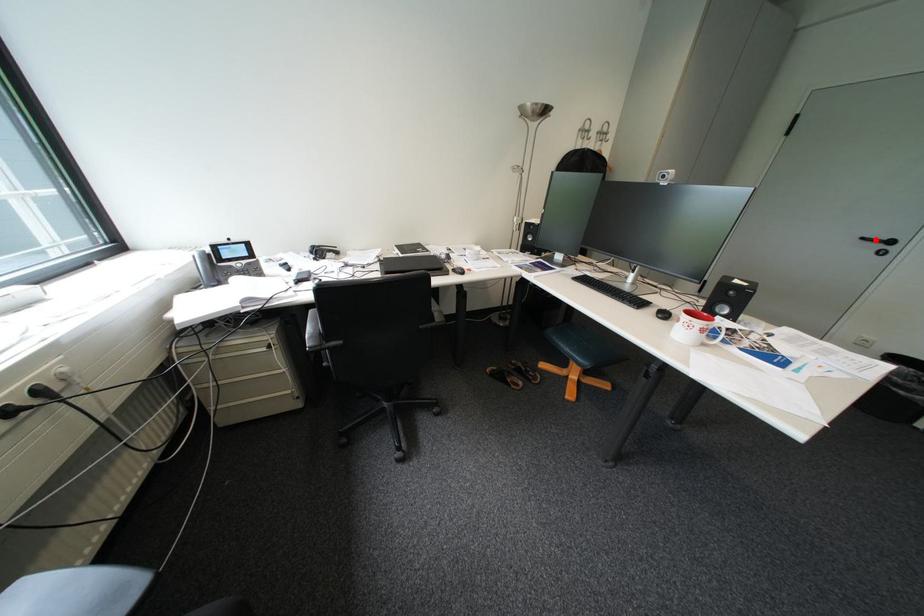
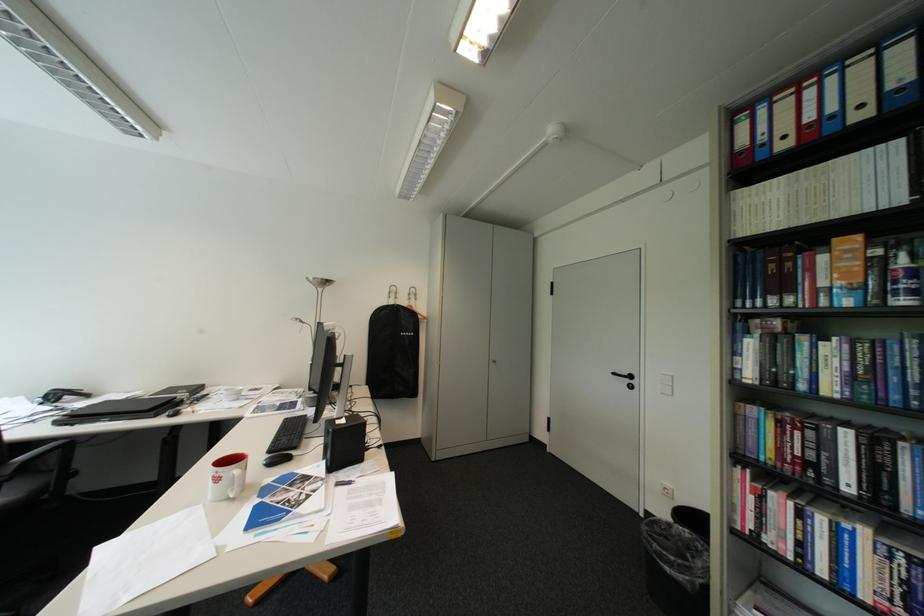
Find the pixel in the second image that matches the highlighted location in the first image.

(626, 374)